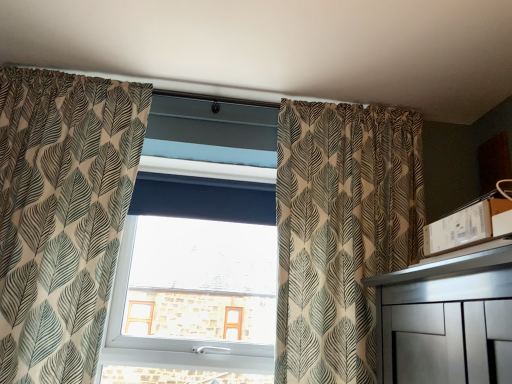
Question: Does point (252, 168) appear closer or farther from the camera than point (142, 109)?

Choices:
 (A) farther
 (B) closer

Answer: (A)

Question: Is transparent glass window at center wider or thinner than patterned fabric curtain at left, acting as the 2th curtain starting from the right?

Choices:
 (A) thin
 (B) wide

Answer: (A)

Question: Which object is the farthest from the transparent glass window at center?

Choices:
 (A) patterned fabric curtain at center, which is the second curtain from left to right
 (B) patterned fabric curtain at left, which ranks as the 1th curtain in left-to-right order

Answer: (A)

Question: Considering the real-world distances, which object is closest to the patterned fabric curtain at left, acting as the 2th curtain starting from the right?

Choices:
 (A) transparent glass window at center
 (B) patterned fabric curtain at center, which is the second curtain from left to right

Answer: (A)